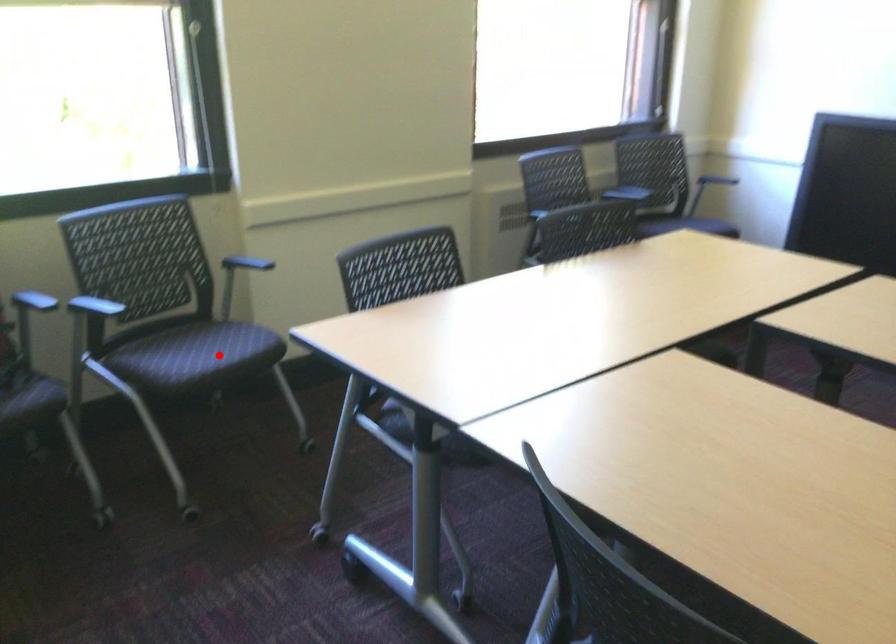
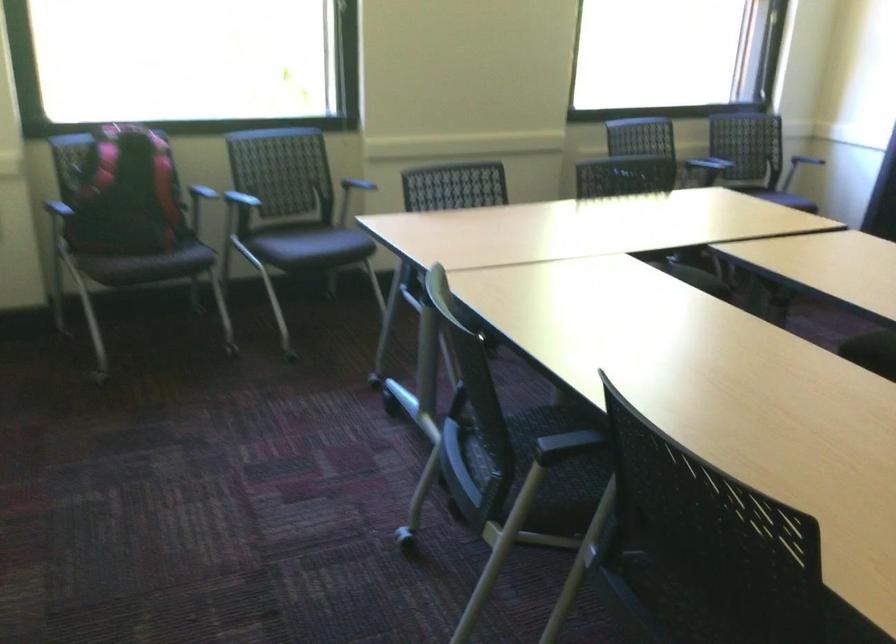
Question: A red point is marked in image1. In image2, is the corresponding 3D point closer to the camera or farther? Reply with the corresponding letter.

Choices:
 (A) The corresponding 3D point is closer.
 (B) The corresponding 3D point is farther.

Answer: (B)